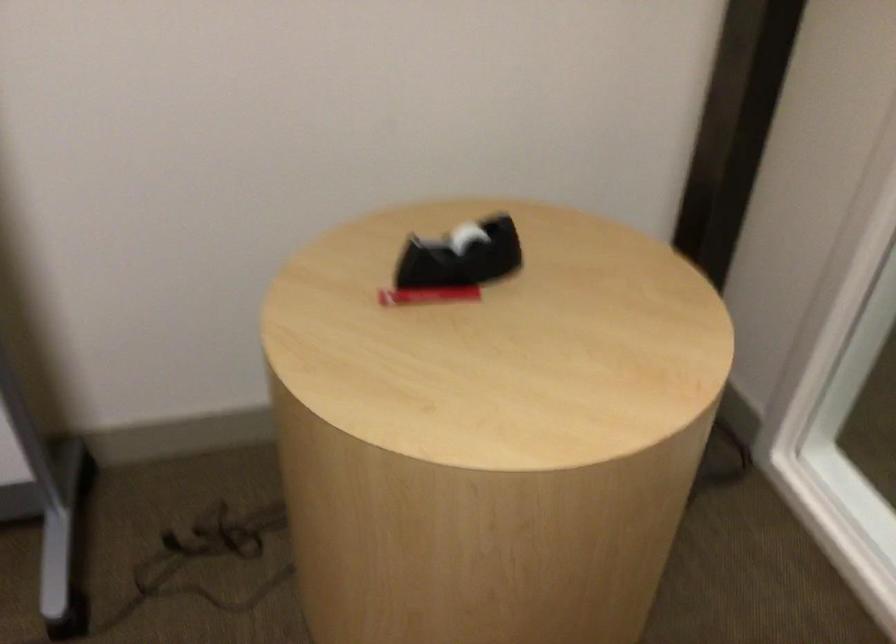
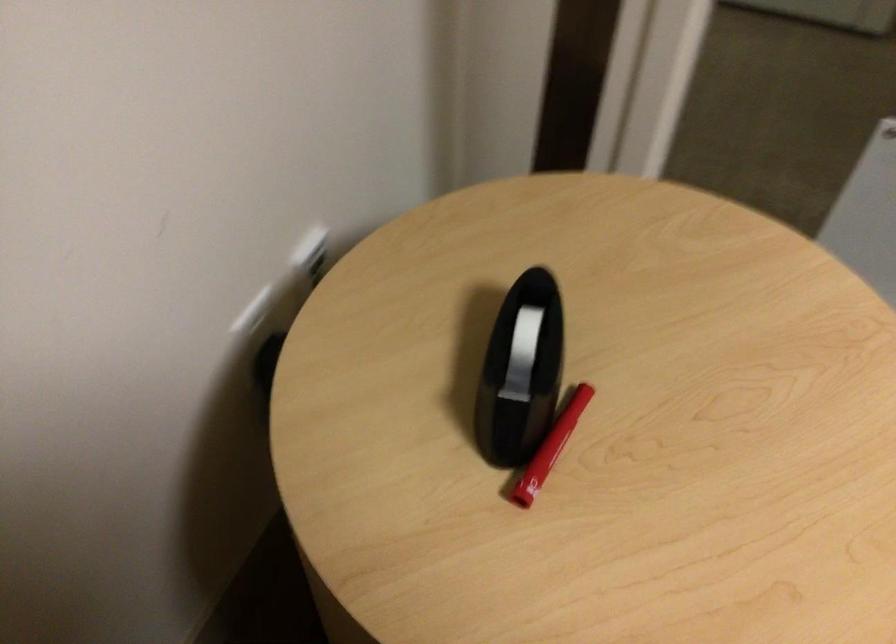
In the second image, find the point that corresponds to point (372, 307) in the first image.

(527, 511)